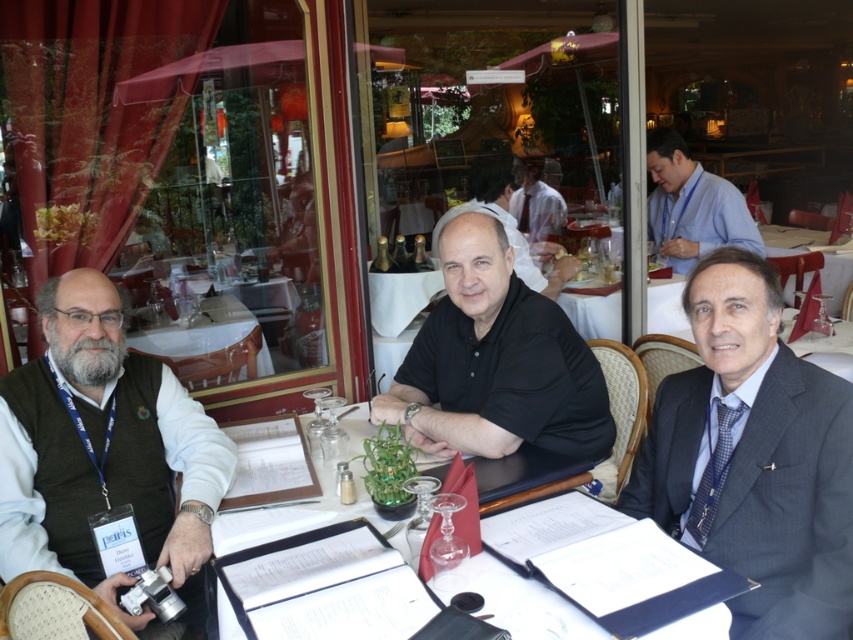
You are a server in this restaurant and need to deliver a drink to the man wearing the dark gray suit at right. Where should you place the drink so it is closest to him but not blocking the white paper at center?

Place the drink to the right of the white paper at center, near the dark gray suit at right, ensuring it doesn not obstruct the white paper.